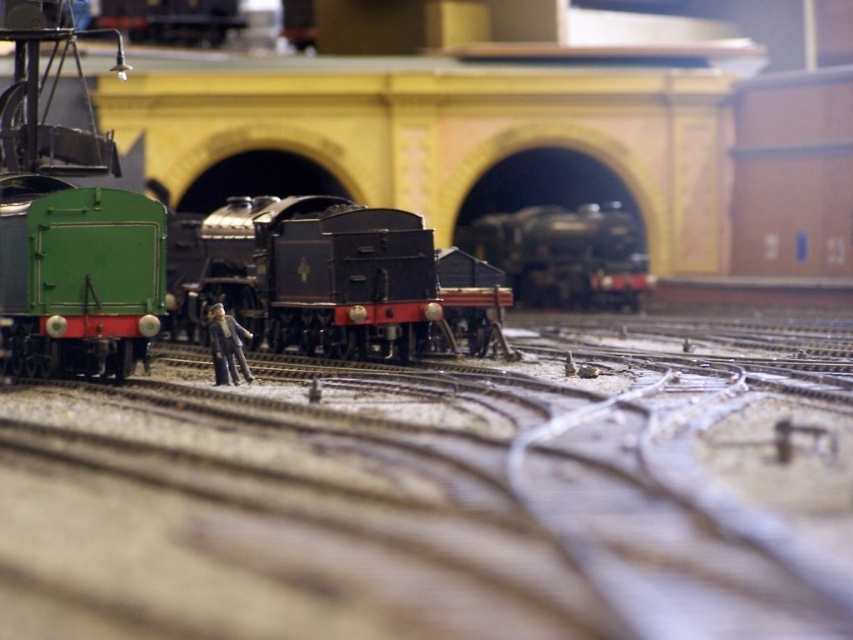
From the picture: You are a model train enthusiast examining the layout. You see a point marked at coordinates (x=331, y=278). What object is located at that point?

The point at coordinates (x=331, y=278) indicates the location of the polished black locomotive at center.